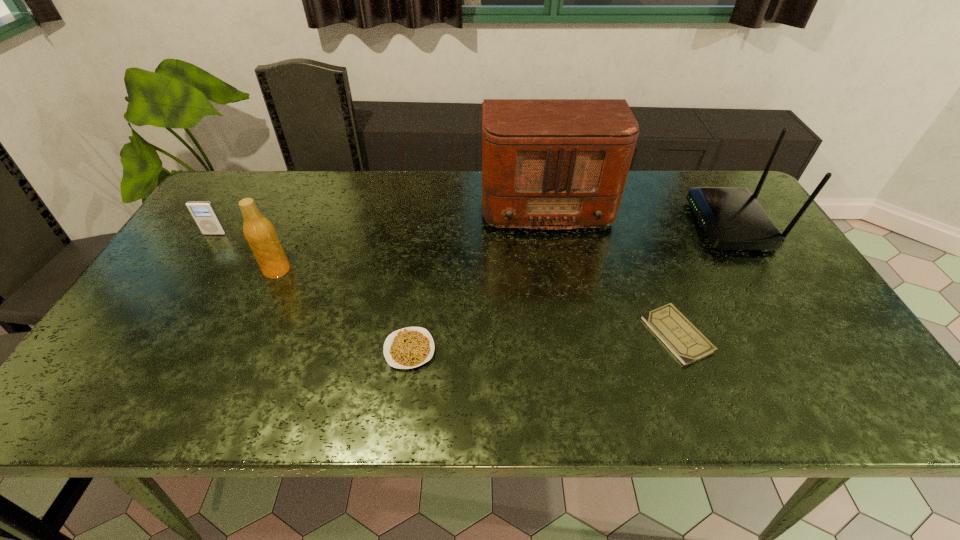
Identify the location of free space located on the front-facing side of the rightmost object. This screenshot has height=540, width=960. point(591,225).

Where is `vacant area located on the front-facing side of the rightmost object`? vacant area located on the front-facing side of the rightmost object is located at coordinates pos(615,225).

Identify the location of free space located on the front-facing side of the rightmost object. (642, 225).

You are a GUI agent. You are given a task and a screenshot of the screen. Output one action in this format:
    pyautogui.click(x=<x>, y=<y>)
    Task: Click on the free space located on the right of the beer bottle
    Image resolution: width=960 pixels, height=540 pixels.
    Given the screenshot: What is the action you would take?
    pyautogui.click(x=358, y=270)

Where is `vacant space situated on the front-facing side of the third shortest object`? vacant space situated on the front-facing side of the third shortest object is located at coordinates (182, 284).

This screenshot has height=540, width=960. I want to click on free space located 0.380m on the right of the legume, so click(604, 350).

The width and height of the screenshot is (960, 540). In order to click on vacant space located 0.120m on the right of the checkbook in this screenshot , I will do `click(759, 334)`.

I want to click on radio receiver positioned at the far edge, so click(546, 163).

Find the location of a particular element. router present at the far edge is located at coordinates (732, 219).

Find the location of a particular element. object that is at the left edge is located at coordinates (203, 212).